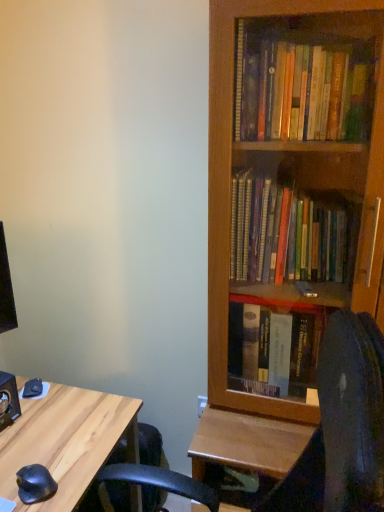
Question: From the image's perspective, is wooden bookcase at right located above black rubber mouse at lower left?

Choices:
 (A) yes
 (B) no

Answer: (A)

Question: Does wooden bookcase at right have a lesser height compared to black rubber mouse at lower left?

Choices:
 (A) no
 (B) yes

Answer: (A)

Question: From a real-world perspective, is wooden bookcase at right below black rubber mouse at lower left?

Choices:
 (A) yes
 (B) no

Answer: (B)

Question: Is wooden bookcase at right turned away from black rubber mouse at lower left?

Choices:
 (A) yes
 (B) no

Answer: (B)

Question: Can you confirm if wooden bookcase at right is positioned to the right of black rubber mouse at lower left?

Choices:
 (A) yes
 (B) no

Answer: (A)

Question: Would you say wooden bookcase at right is inside or outside black rubber mouse at lower left?

Choices:
 (A) inside
 (B) outside

Answer: (B)

Question: Is wooden bookcase at right bigger or smaller than black rubber mouse at lower left?

Choices:
 (A) small
 (B) big

Answer: (B)

Question: Is point (261, 2) positioned closer to the camera than point (23, 477)?

Choices:
 (A) farther
 (B) closer

Answer: (B)

Question: In terms of height, does wooden bookcase at right look taller or shorter compared to black rubber mouse at lower left?

Choices:
 (A) tall
 (B) short

Answer: (A)

Question: In terms of height, does black rubber mouse at lower left look taller or shorter compared to wooden bookcase at right?

Choices:
 (A) short
 (B) tall

Answer: (A)

Question: Is point (36, 466) closer or farther from the camera than point (379, 134)?

Choices:
 (A) closer
 (B) farther

Answer: (B)

Question: Is black rubber mouse at lower left in front of or behind wooden bookcase at right in the image?

Choices:
 (A) front
 (B) behind

Answer: (B)

Question: Looking at their shapes, would you say black rubber mouse at lower left is wider or thinner than wooden bookcase at right?

Choices:
 (A) wide
 (B) thin

Answer: (B)

Question: Looking at their shapes, would you say wooden bookcase at right is wider or thinner than light wood desk at lower left?

Choices:
 (A) wide
 (B) thin

Answer: (B)

Question: Considering the positions of wooden bookcase at right and light wood desk at lower left in the image, is wooden bookcase at right bigger or smaller than light wood desk at lower left?

Choices:
 (A) big
 (B) small

Answer: (A)